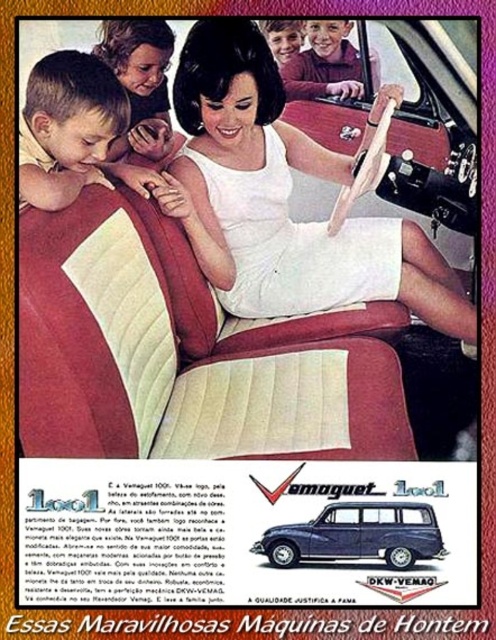
You are a passenger in the car and want to wear your white satin dress at center while sitting in the blue metallic station wagon at center. Do you think the dress might not fit comfortably inside the car?

The white satin dress at center might be wider than the blue metallic station wagon at center, so there might not be enough space for the dress to fit comfortably inside the car.

In the vintage car advertisement for the Vemaguet 1001, there is a woman in a white sleeveless dress driving and three children leaning into the car window. The scene includes a point marked at coordinates (x=67, y=128). What object or feature does this point indicate?

The point at coordinates (x=67, y=128) marks the location of the light brown hair at left.